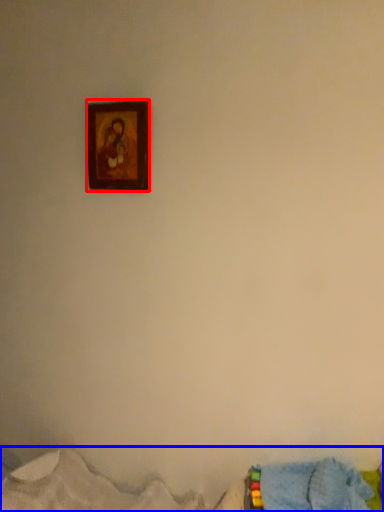
Question: Which object appears closest to the camera in this image, picture frame (highlighted by a red box) or bed (highlighted by a blue box)?

Choices:
 (A) picture frame
 (B) bed

Answer: (B)